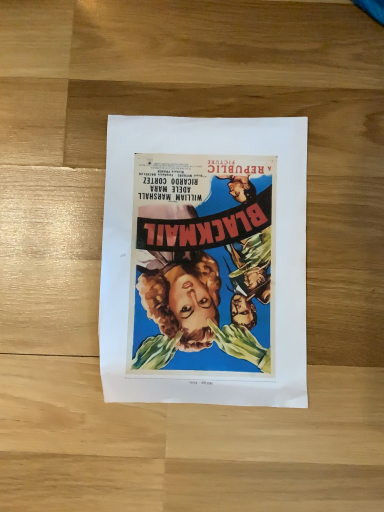
The image size is (384, 512). What do you see at coordinates (204, 261) in the screenshot? I see `matte paper poster at center` at bounding box center [204, 261].

This screenshot has height=512, width=384. Identify the location of matte paper poster at center. (204, 261).

What is the approximate width of matte paper poster at center?

matte paper poster at center is 7.94 inches in width.

Identify the location of matte paper poster at center. (204, 261).